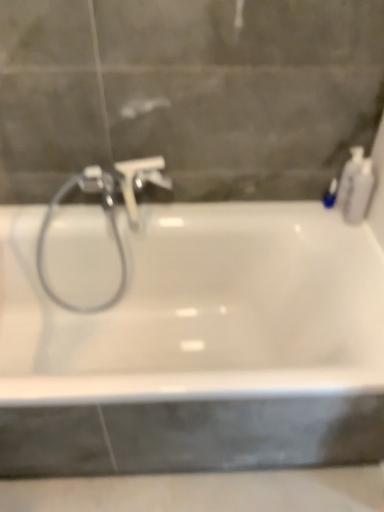
Question: Is blue glossy bottle at upper right, the 3th toiletry from the right, positioned behind white plastic soap dispenser at upper right, marked as the 2th toiletry in a left-to-right arrangement?

Choices:
 (A) no
 (B) yes

Answer: (B)

Question: Is blue glossy bottle at upper right, the 3th toiletry from the right, turned away from white plastic soap dispenser at upper right, marked as the 2th toiletry in a left-to-right arrangement?

Choices:
 (A) no
 (B) yes

Answer: (B)

Question: Considering the relative sizes of blue glossy bottle at upper right, the 3th toiletry from the right, and white plastic soap dispenser at upper right, the 2th toiletry in the right-to-left sequence, in the image provided, is blue glossy bottle at upper right, the 3th toiletry from the right, thinner than white plastic soap dispenser at upper right, the 2th toiletry in the right-to-left sequence,?

Choices:
 (A) no
 (B) yes

Answer: (B)

Question: From the image's perspective, is blue glossy bottle at upper right, which ranks as the first toiletry in left-to-right order, below white plastic soap dispenser at upper right, the 2th toiletry in the right-to-left sequence?

Choices:
 (A) no
 (B) yes

Answer: (B)

Question: From a real-world perspective, is blue glossy bottle at upper right, which ranks as the first toiletry in left-to-right order, positioned over white plastic soap dispenser at upper right, the 2th toiletry in the right-to-left sequence, based on gravity?

Choices:
 (A) yes
 (B) no

Answer: (B)

Question: Visually, is satin nickel faucet at center positioned to the left or to the right of white glossy bathtub at center?

Choices:
 (A) left
 (B) right

Answer: (A)

Question: From the image's perspective, is satin nickel faucet at center located above or below white glossy bathtub at center?

Choices:
 (A) above
 (B) below

Answer: (A)

Question: From a real-world perspective, relative to white glossy bathtub at center, is satin nickel faucet at center vertically above or below?

Choices:
 (A) below
 (B) above

Answer: (B)

Question: Is point (82, 188) positioned closer to the camera than point (203, 238)?

Choices:
 (A) farther
 (B) closer

Answer: (B)

Question: Considering the positions of point (291, 288) and point (337, 204), is point (291, 288) closer or farther from the camera than point (337, 204)?

Choices:
 (A) farther
 (B) closer

Answer: (A)

Question: Looking at the image, does white glossy bathtub at center seem bigger or smaller compared to white plastic soap dispenser at upper right, marked as the 2th toiletry in a left-to-right arrangement?

Choices:
 (A) big
 (B) small

Answer: (A)

Question: Is white glossy bathtub at center to the left or to the right of white plastic soap dispenser at upper right, marked as the 2th toiletry in a left-to-right arrangement, in the image?

Choices:
 (A) right
 (B) left

Answer: (B)

Question: From a real-world perspective, is white glossy bathtub at center physically located above or below white plastic soap dispenser at upper right, the 2th toiletry in the right-to-left sequence?

Choices:
 (A) above
 (B) below

Answer: (B)

Question: From the image's perspective, is white plastic bottle at right, the 3th toiletry positioned from the left, above or below white glossy bathtub at center?

Choices:
 (A) below
 (B) above

Answer: (B)

Question: Is point (362, 190) closer or farther from the camera than point (97, 322)?

Choices:
 (A) closer
 (B) farther

Answer: (A)